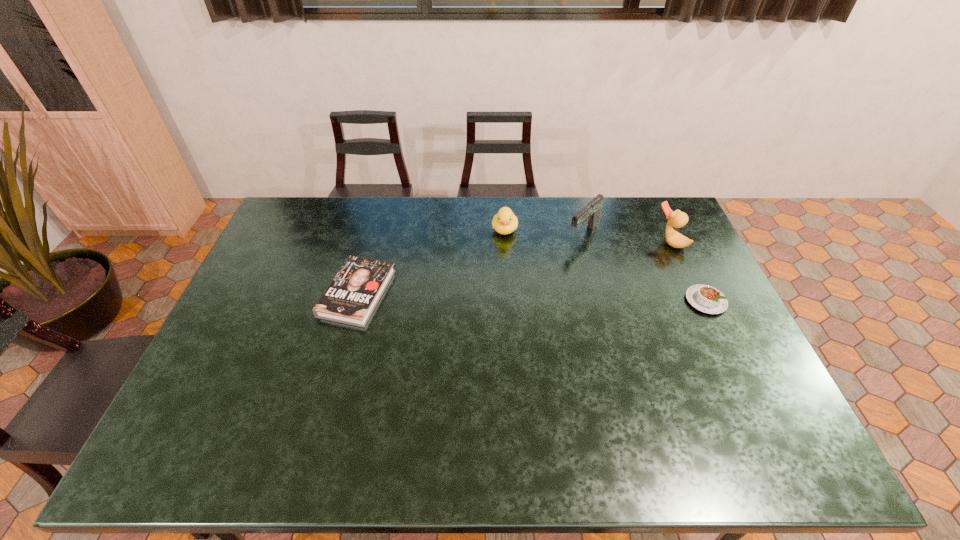
This screenshot has width=960, height=540. I want to click on object that ranks as the closest to the pistol, so click(x=504, y=222).

The image size is (960, 540). Identify the location of free spot that satisfies the following two spatial constraints: 1. on the front side of the shortest object; 2. on the right side of the pudding. (355, 301).

Locate an element on the screen. The image size is (960, 540). free space that satisfies the following two spatial constraints: 1. on the front side of the pudding; 2. on the left side of the third tallest object is located at coordinates (509, 301).

The height and width of the screenshot is (540, 960). Identify the location of blank space that satisfies the following two spatial constraints: 1. on the front side of the pistol; 2. on the left side of the duckling. click(x=505, y=234).

Identify the location of blank area in the image that satisfies the following two spatial constraints: 1. on the front side of the pistol; 2. on the right side of the third shortest object. (505, 234).